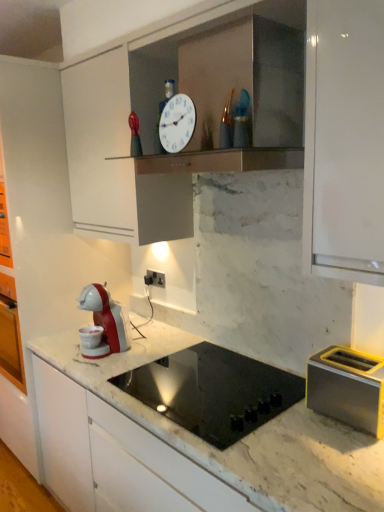
Question: Considering the positions of black glass cooktop at center and black plastic electric outlet at center in the image, is black glass cooktop at center wider or thinner than black plastic electric outlet at center?

Choices:
 (A) thin
 (B) wide

Answer: (B)

Question: From the image's perspective, is black glass cooktop at center positioned above or below black plastic electric outlet at center?

Choices:
 (A) above
 (B) below

Answer: (B)

Question: Which of these objects is positioned closest to the black glass cooktop at center?

Choices:
 (A) metallic yellow toaster at right
 (B) white glossy clock at upper center
 (C) black plastic electric outlet at center

Answer: (A)

Question: Estimate the real-world distances between objects in this image. Which object is farther from the black glass cooktop at center?

Choices:
 (A) white glossy clock at upper center
 (B) metallic yellow toaster at right
 (C) black plastic electric outlet at center

Answer: (A)